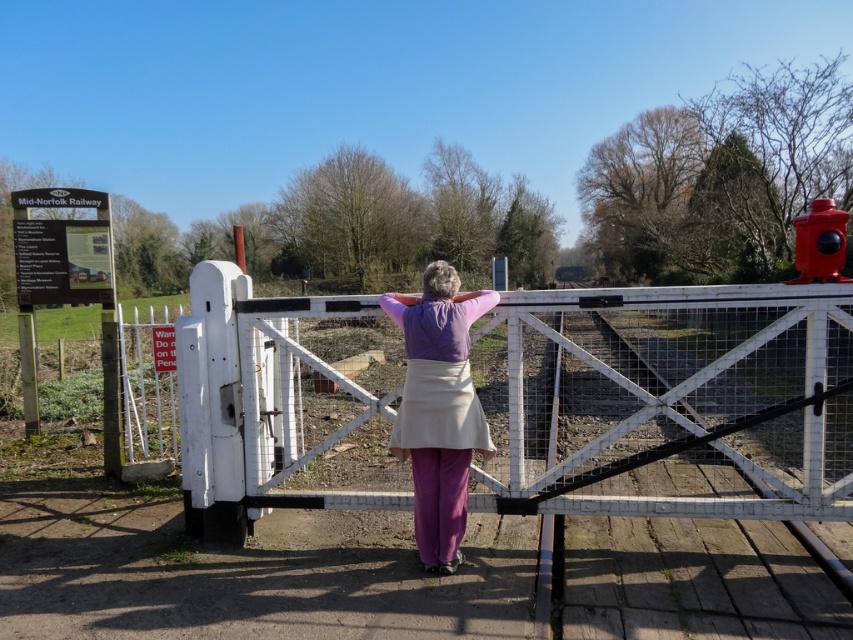
Does purple matte shirt at center have a greater width compared to shiny red hydrant at upper right?

In fact, purple matte shirt at center might be narrower than shiny red hydrant at upper right.

Can you confirm if purple matte shirt at center is shorter than shiny red hydrant at upper right?

Yes.

Image resolution: width=853 pixels, height=640 pixels. In order to click on purple matte shirt at center in this screenshot , I will do `click(438, 408)`.